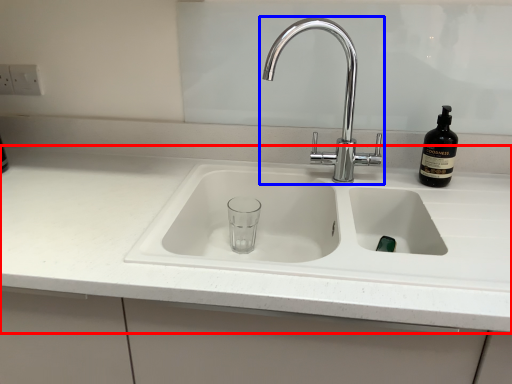
Question: Among these objects, which one is nearest to the camera, countertop (highlighted by a red box) or tap (highlighted by a blue box)?

Choices:
 (A) countertop
 (B) tap

Answer: (A)